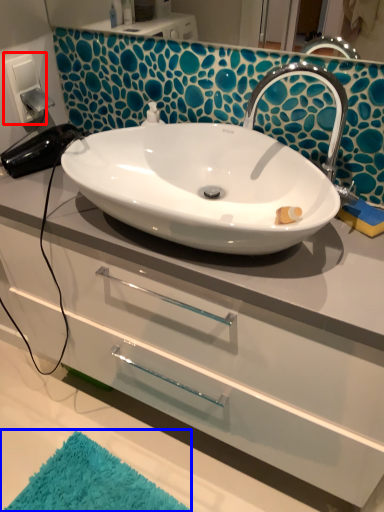
Question: Among these objects, which one is farthest to the camera, electric outlet (highlighted by a red box) or bath mat (highlighted by a blue box)?

Choices:
 (A) electric outlet
 (B) bath mat

Answer: (A)